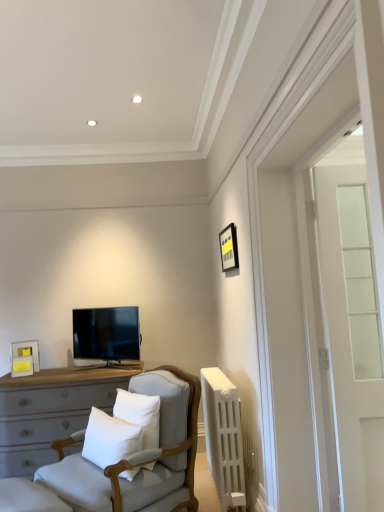
Question: Which direction should I rotate to look at white soft cushion at center, the 2th pillow viewed from the left?

Choices:
 (A) right
 (B) left

Answer: (B)

Question: Is light gray fabric chair at center positioned with its back to matte black picture frame at upper right, the 1th picture frame viewed from the top?

Choices:
 (A) yes
 (B) no

Answer: (B)

Question: Can you confirm if light gray fabric chair at center is bigger than matte black picture frame at upper right, acting as the 1th picture frame starting from the front?

Choices:
 (A) no
 (B) yes

Answer: (B)

Question: Does light gray fabric chair at center appear on the right side of matte black picture frame at upper right, the 1th picture frame viewed from the top?

Choices:
 (A) yes
 (B) no

Answer: (B)

Question: Is light gray fabric chair at center in front of matte black picture frame at upper right, which ranks as the second picture frame in left-to-right order?

Choices:
 (A) no
 (B) yes

Answer: (B)

Question: Can you confirm if light gray fabric chair at center is shorter than matte black picture frame at upper right, the 1th picture frame viewed from the top?

Choices:
 (A) yes
 (B) no

Answer: (B)

Question: Considering the relative sizes of light gray fabric chair at center and matte black picture frame at upper right, which is the second picture frame in back-to-front order, in the image provided, is light gray fabric chair at center smaller than matte black picture frame at upper right, which is the second picture frame in back-to-front order,?

Choices:
 (A) yes
 (B) no

Answer: (B)

Question: Is matte white picture frame at left, which is the first picture frame in left-to-right order, oriented towards matte black picture frame at upper right, acting as the 1th picture frame starting from the front?

Choices:
 (A) no
 (B) yes

Answer: (A)

Question: Is matte white picture frame at left, the 2th picture frame viewed from the top, turned away from matte black picture frame at upper right, the 1th picture frame viewed from the top?

Choices:
 (A) no
 (B) yes

Answer: (A)

Question: Is matte white picture frame at left, which appears as the first picture frame when ordered from the bottom, placed right next to matte black picture frame at upper right, which is the second picture frame in back-to-front order?

Choices:
 (A) yes
 (B) no

Answer: (B)

Question: From a real-world perspective, is matte white picture frame at left, which appears as the 2th picture frame when viewed from the right, located beneath matte black picture frame at upper right, which is the first picture frame in right-to-left order?

Choices:
 (A) yes
 (B) no

Answer: (A)

Question: Is matte white picture frame at left, the 2th picture frame viewed from the top, positioned behind matte black picture frame at upper right, which is the first picture frame in right-to-left order?

Choices:
 (A) no
 (B) yes

Answer: (B)

Question: Does matte white picture frame at left, which appears as the 2th picture frame when viewed from the right, come in front of matte black picture frame at upper right, acting as the 1th picture frame starting from the front?

Choices:
 (A) yes
 (B) no

Answer: (B)

Question: Is matte white picture frame at left, which appears as the 2th picture frame when viewed from the right, aimed at white plastic radiator at right?

Choices:
 (A) no
 (B) yes

Answer: (A)